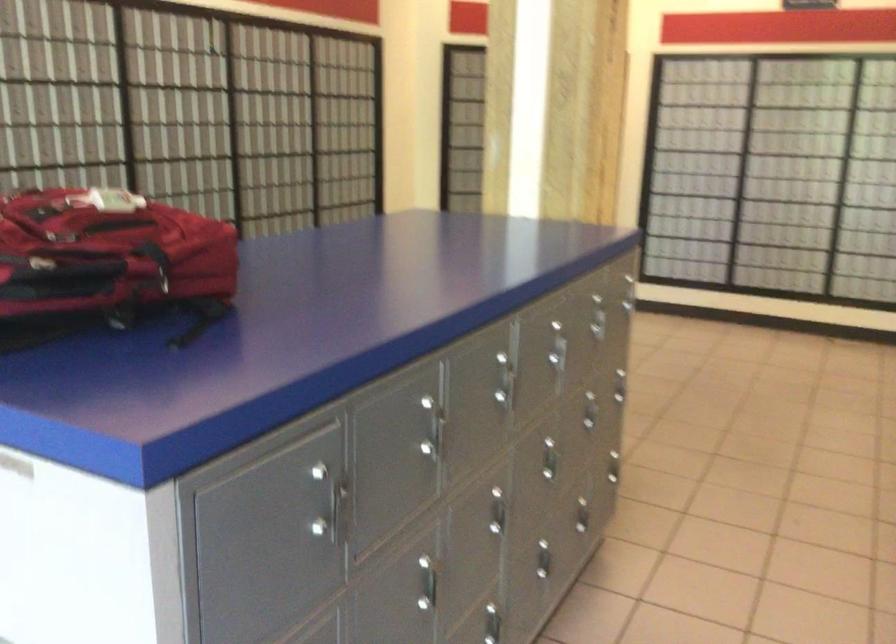
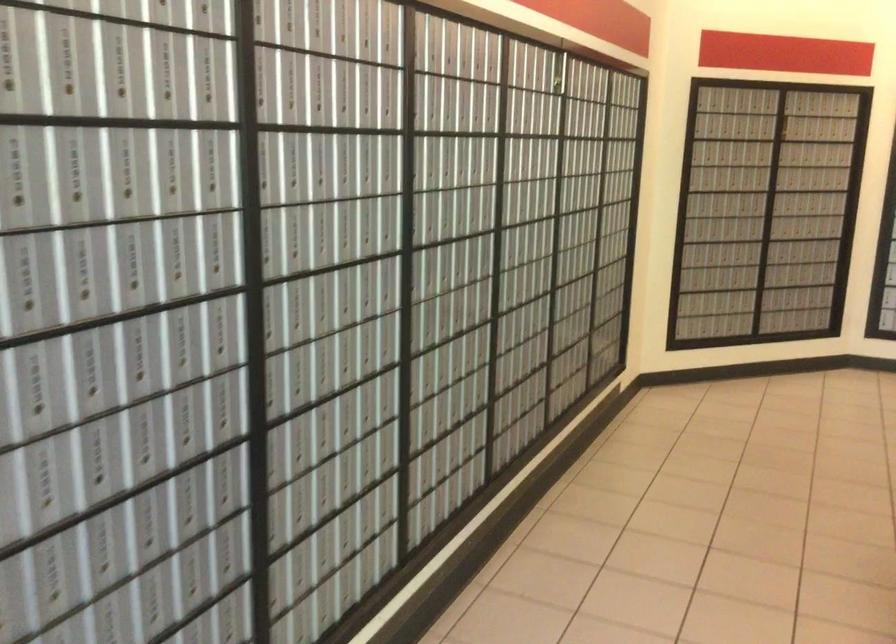
Which direction would the cameraman need to move to produce the second image?

The cameraman moved toward left, forward.